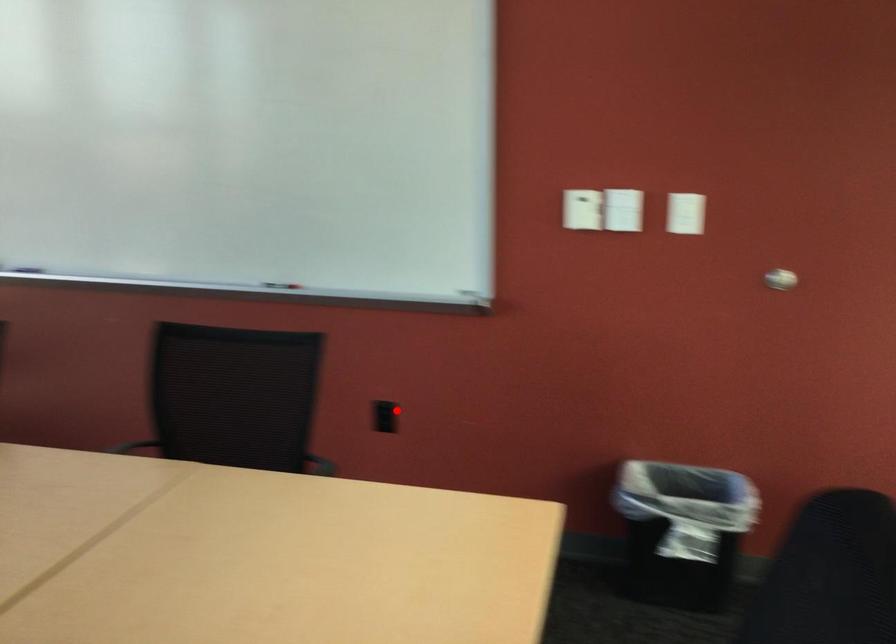
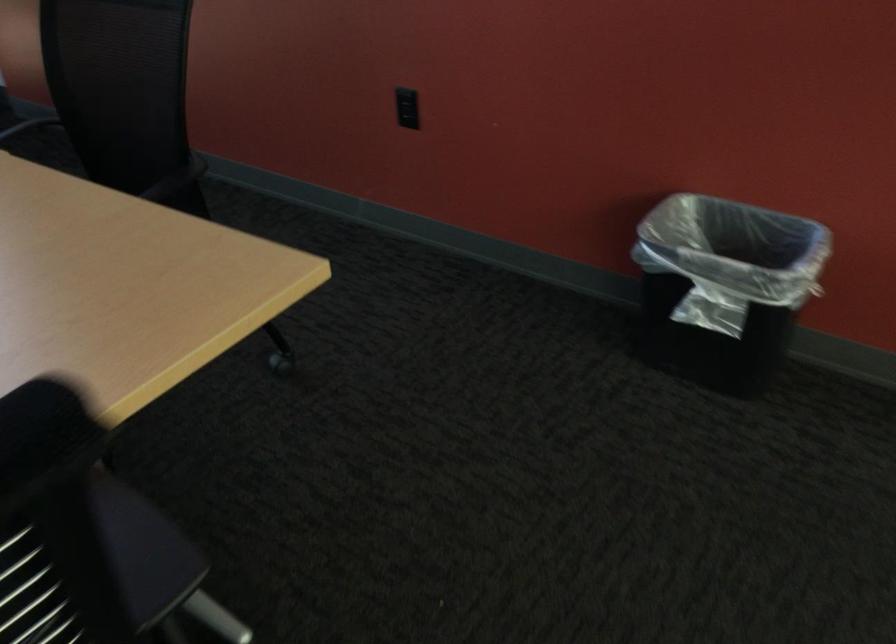
Question: I am providing you with two images of the same scene from different viewpoints. In image1, a red point is highlighted. Considering the same 3D point in image2, which of the following is correct?

Choices:
 (A) It is closer
 (B) It is farther

Answer: (A)